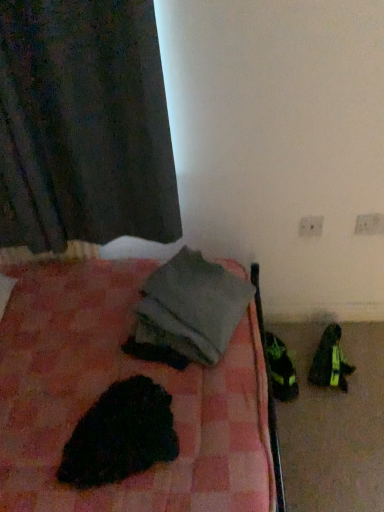
Question: Considering the relative positions of gray fabric at center and white plastic electric outlet at upper right, which is counted as the 1th electric outlet, starting from the right, in the image provided, is gray fabric at center to the left of white plastic electric outlet at upper right, which is counted as the 1th electric outlet, starting from the right, from the viewer's perspective?

Choices:
 (A) no
 (B) yes

Answer: (B)

Question: Is gray fabric at center not near white plastic electric outlet at upper right, positioned as the second electric outlet in left-to-right order?

Choices:
 (A) no
 (B) yes

Answer: (A)

Question: From the image's perspective, is gray fabric at center above white plastic electric outlet at upper right, which is counted as the 1th electric outlet, starting from the right?

Choices:
 (A) yes
 (B) no

Answer: (B)

Question: Is gray fabric at center in contact with white plastic electric outlet at upper right, positioned as the second electric outlet in left-to-right order?

Choices:
 (A) yes
 (B) no

Answer: (B)

Question: Is gray fabric at center facing away from white plastic electric outlet at upper right, which is counted as the 1th electric outlet, starting from the right?

Choices:
 (A) no
 (B) yes

Answer: (A)

Question: From a real-world perspective, is white plastic electric outlet at upper right, positioned as the second electric outlet in left-to-right order, above or below black fuzzy animal at lower left?

Choices:
 (A) below
 (B) above

Answer: (A)

Question: Looking at their shapes, would you say white plastic electric outlet at upper right, positioned as the second electric outlet in left-to-right order, is wider or thinner than black fuzzy animal at lower left?

Choices:
 (A) thin
 (B) wide

Answer: (A)

Question: Do you think white plastic electric outlet at upper right, which is counted as the 1th electric outlet, starting from the right, is within black fuzzy animal at lower left, or outside of it?

Choices:
 (A) inside
 (B) outside

Answer: (B)

Question: Is white plastic electric outlet at upper right, positioned as the second electric outlet in left-to-right order, to the left or to the right of black fuzzy animal at lower left in the image?

Choices:
 (A) left
 (B) right

Answer: (B)

Question: From the image's perspective, is white plastic electric outlet at upper right, marked as the 2th electric outlet in a right-to-left arrangement, located above or below white plastic electric outlet at upper right, which is counted as the 1th electric outlet, starting from the right?

Choices:
 (A) above
 (B) below

Answer: (B)

Question: Considering the positions of point (304, 228) and point (377, 217), is point (304, 228) closer or farther from the camera than point (377, 217)?

Choices:
 (A) closer
 (B) farther

Answer: (B)

Question: Looking at their shapes, would you say white plastic electric outlet at upper right, marked as the 2th electric outlet in a right-to-left arrangement, is wider or thinner than white plastic electric outlet at upper right, positioned as the second electric outlet in left-to-right order?

Choices:
 (A) wide
 (B) thin

Answer: (B)

Question: Relative to white plastic electric outlet at upper right, positioned as the second electric outlet in left-to-right order, is white plastic electric outlet at upper right, marked as the 2th electric outlet in a right-to-left arrangement, in front or behind?

Choices:
 (A) front
 (B) behind

Answer: (B)

Question: Based on their sizes in the image, would you say black fuzzy animal at lower left is bigger or smaller than gray fabric at center?

Choices:
 (A) big
 (B) small

Answer: (B)

Question: Looking at their shapes, would you say black fuzzy animal at lower left is wider or thinner than gray fabric at center?

Choices:
 (A) wide
 (B) thin

Answer: (B)